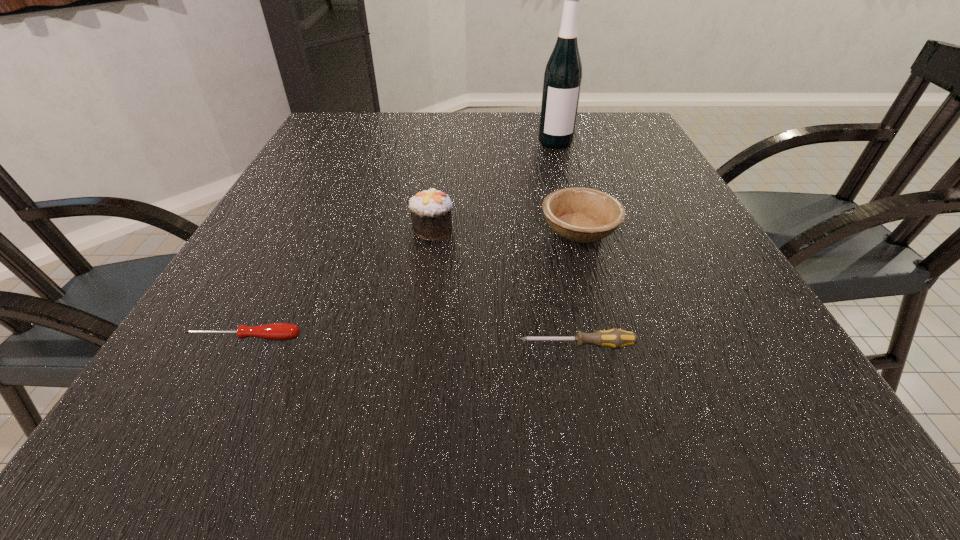
This screenshot has height=540, width=960. What are the coordinates of `free space located at the tip of the right screwdriver` in the screenshot? It's located at pos(421,346).

The width and height of the screenshot is (960, 540). I want to click on vacant space situated 0.330m at the tip of the right screwdriver, so coord(302,346).

Find the location of a particular element. vacant space situated at the tip of the right screwdriver is located at coordinates (329, 346).

You are a GUI agent. You are given a task and a screenshot of the screen. Output one action in this format:
    pyautogui.click(x=<x>, y=<y>)
    Task: Click on the free region located 0.130m on the front of the left screwdriver
    Image resolution: width=960 pixels, height=540 pixels.
    Given the screenshot: What is the action you would take?
    pyautogui.click(x=201, y=422)

Locate an element on the screen. object that is at the far edge is located at coordinates (562, 81).

I want to click on object located in the left edge section of the desktop, so click(276, 331).

You are a GUI agent. You are given a task and a screenshot of the screen. Output one action in this format:
    pyautogui.click(x=<x>, y=<y>)
    Task: Click on the free space at the far edge
    This screenshot has width=960, height=540.
    Given the screenshot: What is the action you would take?
    pyautogui.click(x=494, y=116)

Where is `blank space at the left edge of the desktop`? blank space at the left edge of the desktop is located at coordinates (288, 260).

I want to click on free space at the right edge of the desktop, so click(749, 291).

The height and width of the screenshot is (540, 960). In the image, there is a desktop. Find the location of `blank space at the far left corner`. blank space at the far left corner is located at coordinates (324, 124).